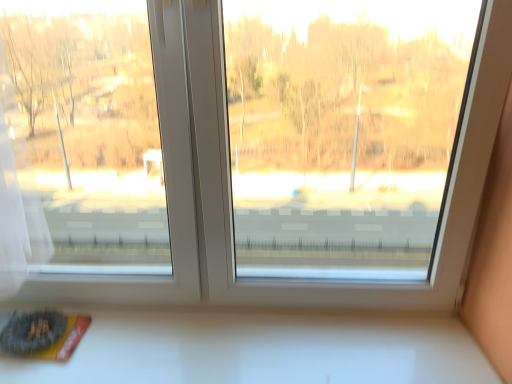
What is the approximate height of matte gray paperback book at lower left?

matte gray paperback book at lower left is 1.69 inches tall.

You are a GUI agent. You are given a task and a screenshot of the screen. Output one action in this format:
    pyautogui.click(x=<x>, y=<y>)
    Task: Click on the matte gray paperback book at lower left
    Image resolution: width=512 pixels, height=384 pixels.
    Given the screenshot: What is the action you would take?
    pyautogui.click(x=41, y=334)

The width and height of the screenshot is (512, 384). What do you see at coordinates (41, 334) in the screenshot?
I see `matte gray paperback book at lower left` at bounding box center [41, 334].

Measure the distance between point (7, 346) and camera.

A distance of 3.74 feet exists between point (7, 346) and camera.

What are the coordinates of `matte gray paperback book at lower left` in the screenshot? It's located at (41, 334).